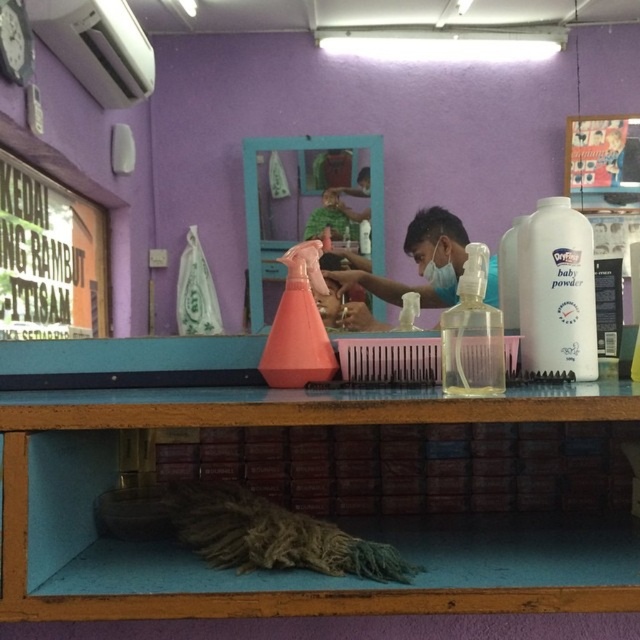
Can you confirm if wooden at lower center is wider than white plastic baby powder at right?

Yes, wooden at lower center is wider than white plastic baby powder at right.

How much distance is there between wooden at lower center and white plastic baby powder at right?

wooden at lower center is 12.31 inches away from white plastic baby powder at right.

Who is more distant from viewer, (131, 557) or (584, 305)?

The point (584, 305) is more distant.

The width and height of the screenshot is (640, 640). Find the location of `wooden at lower center`. wooden at lower center is located at coordinates (284, 573).

Consider the image. Measure the distance between transparent plastic bottle at center and clear plastic spray bottle at center.

transparent plastic bottle at center is 12.66 inches from clear plastic spray bottle at center.

Which is below, transparent plastic bottle at center or clear plastic spray bottle at center?

clear plastic spray bottle at center is lower down.

Is point (435, 234) farther from viewer compared to point (451, 372)?

Yes, point (435, 234) is behind point (451, 372).

Where is `transparent plastic bottle at center`? transparent plastic bottle at center is located at coordinates (419, 260).

Does wooden at lower center appear over clear plastic spray bottle at center?

Incorrect, wooden at lower center is not positioned above clear plastic spray bottle at center.

Describe the element at coordinates (284, 573) in the screenshot. I see `wooden at lower center` at that location.

The image size is (640, 640). Find the location of `wooden at lower center`. wooden at lower center is located at coordinates (284, 573).